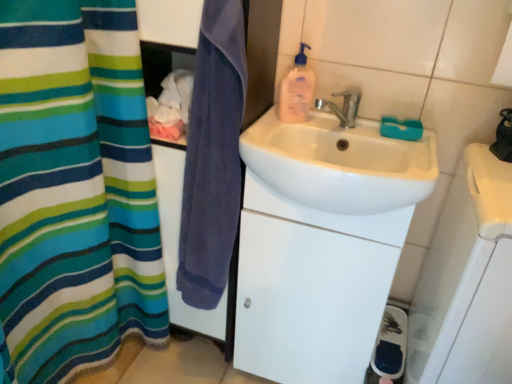
Question: Does white glossy cabinet at center have a greater height compared to purple cotton towel at center?

Choices:
 (A) yes
 (B) no

Answer: (A)

Question: Can you confirm if white glossy cabinet at center is smaller than purple cotton towel at center?

Choices:
 (A) yes
 (B) no

Answer: (B)

Question: Is purple cotton towel at center surrounded by white glossy cabinet at center?

Choices:
 (A) yes
 (B) no

Answer: (B)

Question: Can you confirm if white glossy cabinet at center is positioned to the left of purple cotton towel at center?

Choices:
 (A) no
 (B) yes

Answer: (A)

Question: From a real-world perspective, is white glossy cabinet at center on purple cotton towel at center?

Choices:
 (A) yes
 (B) no

Answer: (B)

Question: Considering the relative sizes of white glossy cabinet at center and purple cotton towel at center in the image provided, is white glossy cabinet at center thinner than purple cotton towel at center?

Choices:
 (A) no
 (B) yes

Answer: (A)

Question: Is the depth of white glossy sink at center greater than that of purple cotton towel at center?

Choices:
 (A) yes
 (B) no

Answer: (A)

Question: Can you confirm if white glossy sink at center is thinner than purple cotton towel at center?

Choices:
 (A) no
 (B) yes

Answer: (A)

Question: Is white glossy sink at center next to purple cotton towel at center?

Choices:
 (A) no
 (B) yes

Answer: (A)

Question: Is white glossy sink at center aimed at purple cotton towel at center?

Choices:
 (A) yes
 (B) no

Answer: (B)

Question: Is white glossy sink at center turned away from purple cotton towel at center?

Choices:
 (A) no
 (B) yes

Answer: (A)

Question: From a real-world perspective, is white glossy sink at center over purple cotton towel at center?

Choices:
 (A) yes
 (B) no

Answer: (A)

Question: From a real-world perspective, is metallic silver faucet at upper center positioned under white plastic soap dish at right based on gravity?

Choices:
 (A) no
 (B) yes

Answer: (A)